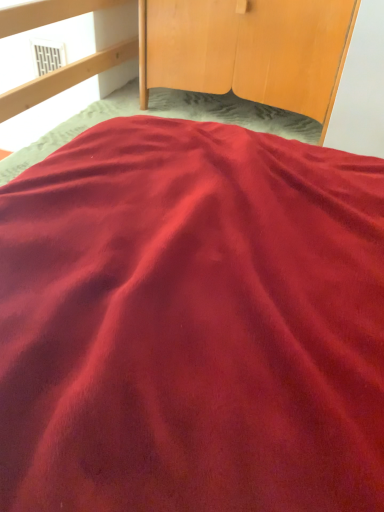
Question: Considering the relative sizes of wooden wardrobe at upper center and white vent at upper left in the image provided, is wooden wardrobe at upper center wider than white vent at upper left?

Choices:
 (A) yes
 (B) no

Answer: (A)

Question: Is wooden wardrobe at upper center positioned in front of white vent at upper left?

Choices:
 (A) yes
 (B) no

Answer: (A)

Question: Is wooden wardrobe at upper center turned away from white vent at upper left?

Choices:
 (A) yes
 (B) no

Answer: (B)

Question: Is white vent at upper left located within wooden wardrobe at upper center?

Choices:
 (A) yes
 (B) no

Answer: (B)

Question: Are wooden wardrobe at upper center and white vent at upper left located far from each other?

Choices:
 (A) yes
 (B) no

Answer: (B)

Question: Is wooden wardrobe at upper center oriented towards white vent at upper left?

Choices:
 (A) no
 (B) yes

Answer: (A)

Question: Is white vent at upper left facing towards wooden wardrobe at upper center?

Choices:
 (A) yes
 (B) no

Answer: (B)

Question: From the image's perspective, is white vent at upper left located beneath wooden wardrobe at upper center?

Choices:
 (A) yes
 (B) no

Answer: (B)

Question: Is wooden wardrobe at upper center a part of white vent at upper left?

Choices:
 (A) no
 (B) yes

Answer: (A)

Question: Is white vent at upper left thinner than wooden wardrobe at upper center?

Choices:
 (A) yes
 (B) no

Answer: (A)

Question: Is white vent at upper left behind wooden wardrobe at upper center?

Choices:
 (A) no
 (B) yes

Answer: (B)

Question: Is white vent at upper left bigger than wooden wardrobe at upper center?

Choices:
 (A) no
 (B) yes

Answer: (A)

Question: Considering the positions of wooden wardrobe at upper center and white vent at upper left in the image, is wooden wardrobe at upper center wider or thinner than white vent at upper left?

Choices:
 (A) wide
 (B) thin

Answer: (A)